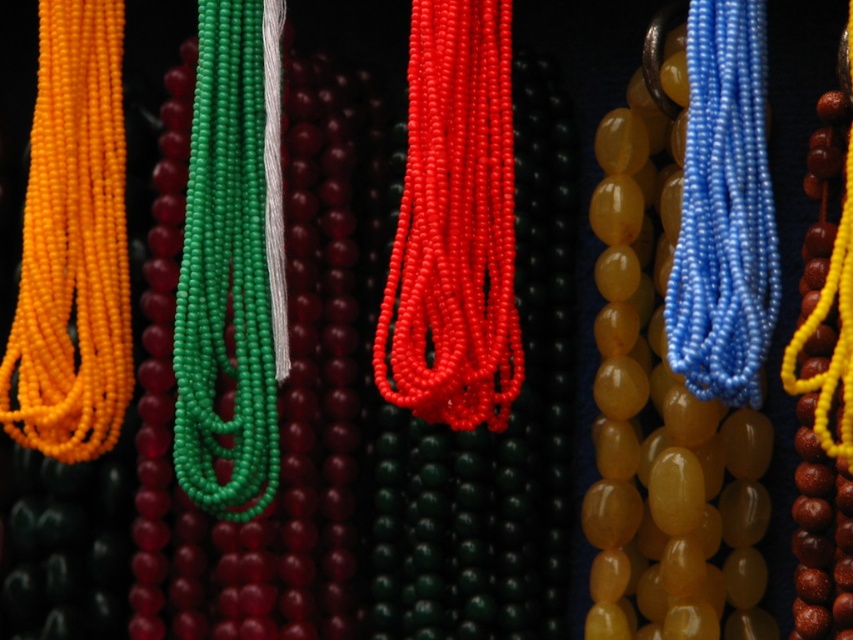
Is point (51, 116) closer to camera compared to point (695, 252)?

No, (51, 116) is further to viewer.

Is matte yellow rope at left below blue glossy beads at right?

Indeed, matte yellow rope at left is positioned under blue glossy beads at right.

Image resolution: width=853 pixels, height=640 pixels. In order to click on matte yellow rope at left in this screenshot , I will do `click(73, 244)`.

Between shiny red beads at center and matte yellow rope at left, which one appears on the right side from the viewer's perspective?

From the viewer's perspective, shiny red beads at center appears more on the right side.

Can you confirm if shiny red beads at center is taller than matte yellow rope at left?

No.

Is point (438, 237) farther from camera compared to point (80, 385)?

No, (438, 237) is closer to viewer.

I want to click on shiny red beads at center, so click(454, 225).

From the picture: Can you confirm if matte yellow rope at left is taller than green matte beads at center?

No, matte yellow rope at left is not taller than green matte beads at center.

Can you confirm if matte yellow rope at left is thinner than green matte beads at center?

No, matte yellow rope at left is not thinner than green matte beads at center.

Is point (54, 182) behind point (204, 298)?

Yes.

Find the location of a particular element. Image resolution: width=853 pixels, height=640 pixels. matte yellow rope at left is located at coordinates (73, 244).